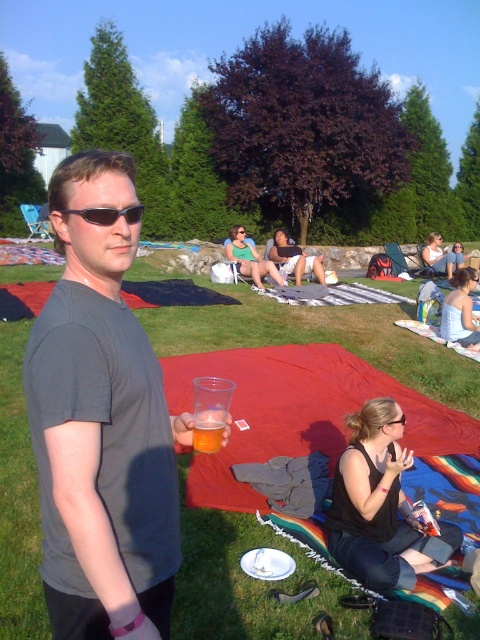
Consider the image. You are standing at the edge of the grassy area and want to place a small potted plant between the black fabric at lower right and the matte black shorts at center. Based on their positions, where should you place the plant?

The black fabric at lower right is below matte black shorts at center, so you should place the small potted plant between them by positioning it above the black fabric at lower right and below the matte black shorts at center.